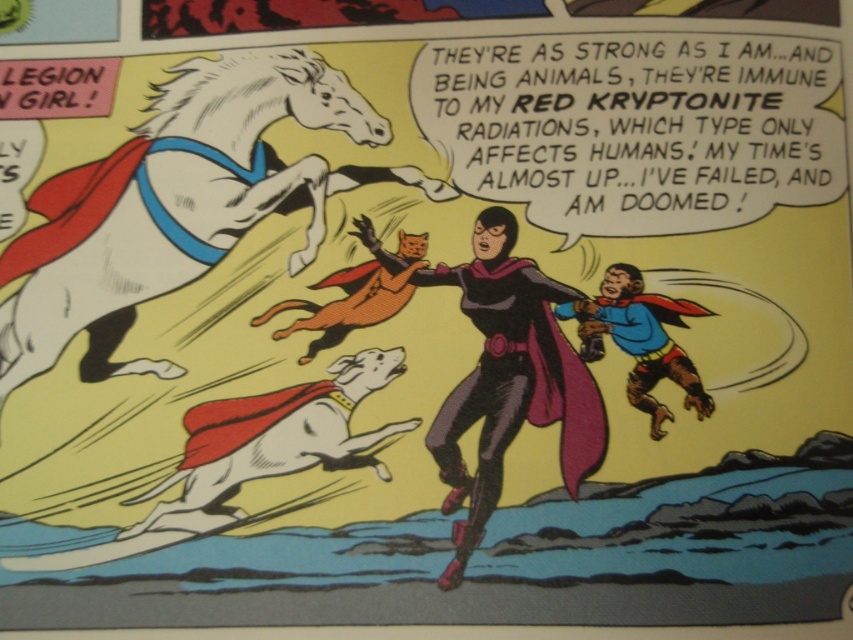
Question: In this image, where is white glossy horse at upper left located relative to black glossy cape at center?

Choices:
 (A) right
 (B) left

Answer: (B)

Question: Which of these objects is positioned closest to the white glossy horse at upper left?

Choices:
 (A) blue fabric cape at lower right
 (B) black glossy cape at center

Answer: (B)

Question: Can you confirm if white glossy horse at upper left is smaller than black glossy cape at center?

Choices:
 (A) yes
 (B) no

Answer: (B)

Question: Observing the image, what is the correct spatial positioning of black glossy cape at center in reference to blue fabric cape at lower right?

Choices:
 (A) right
 (B) left

Answer: (B)

Question: Based on their relative distances, which object is farther from the white glossy horse at upper left?

Choices:
 (A) black glossy cape at center
 (B) blue fabric cape at lower right

Answer: (B)

Question: Which of these objects is positioned farthest from the black glossy cape at center?

Choices:
 (A) blue fabric cape at lower right
 (B) white glossy horse at upper left

Answer: (B)